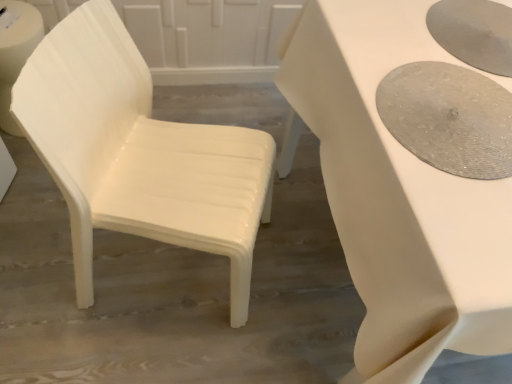
This screenshot has width=512, height=384. Find the location of `vacant space in matte silver tray at right (from a real-world perspective)`. vacant space in matte silver tray at right (from a real-world perspective) is located at coordinates (449, 109).